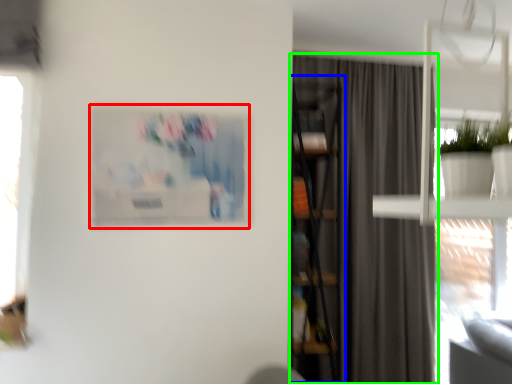
Question: Considering the real-world distances, which object is farthest from picture frame (highlighted by a red box)? bookcase (highlighted by a blue box) or curtain (highlighted by a green box)?

Choices:
 (A) bookcase
 (B) curtain

Answer: (B)